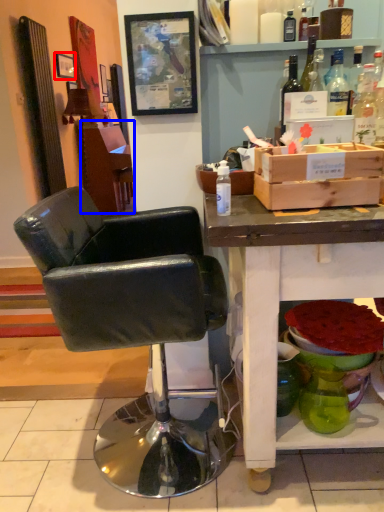
Question: Among these objects, which one is nearest to the camera, picture frame (highlighted by a red box) or vanity (highlighted by a blue box)?

Choices:
 (A) picture frame
 (B) vanity

Answer: (A)